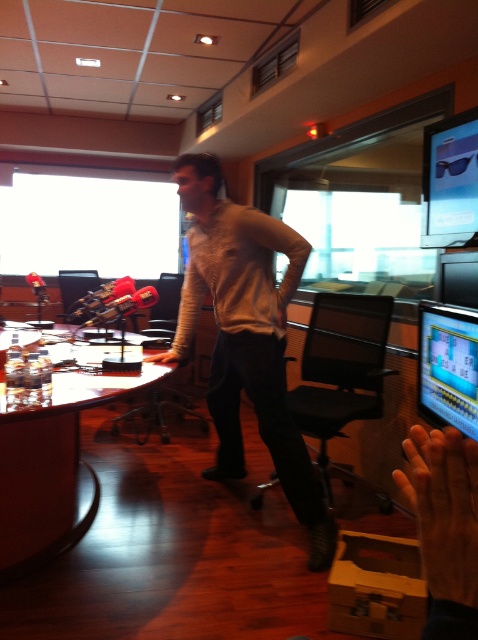
Question: Which point is closer to the camera?

Choices:
 (A) (454, 228)
 (B) (330, 426)

Answer: (A)

Question: Does matte black monitor at right have a smaller size compared to satin black sunglasses at upper right?

Choices:
 (A) yes
 (B) no

Answer: (A)

Question: Can you confirm if light beige sweater at center is bigger than black mesh swivel chair at center?

Choices:
 (A) yes
 (B) no

Answer: (A)

Question: Which of the following is the closest to the observer?

Choices:
 (A) light beige sweater at center
 (B) matte black monitor at right
 (C) satin black sunglasses at upper right
 (D) black mesh swivel chair at center

Answer: (B)

Question: Can you confirm if light beige sweater at center is thinner than black mesh swivel chair at center?

Choices:
 (A) no
 (B) yes

Answer: (A)

Question: Among these points, which one is nearest to the camera?

Choices:
 (A) (445, 317)
 (B) (380, 300)
 (C) (476, 193)

Answer: (A)